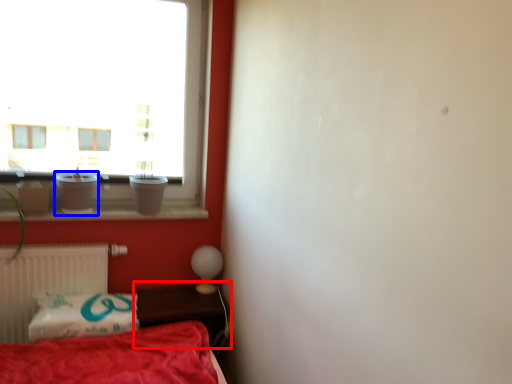
Question: Which of the following is the closest to the observer, table (highlighted by a red box) or glass vase (highlighted by a blue box)?

Choices:
 (A) table
 (B) glass vase

Answer: (A)